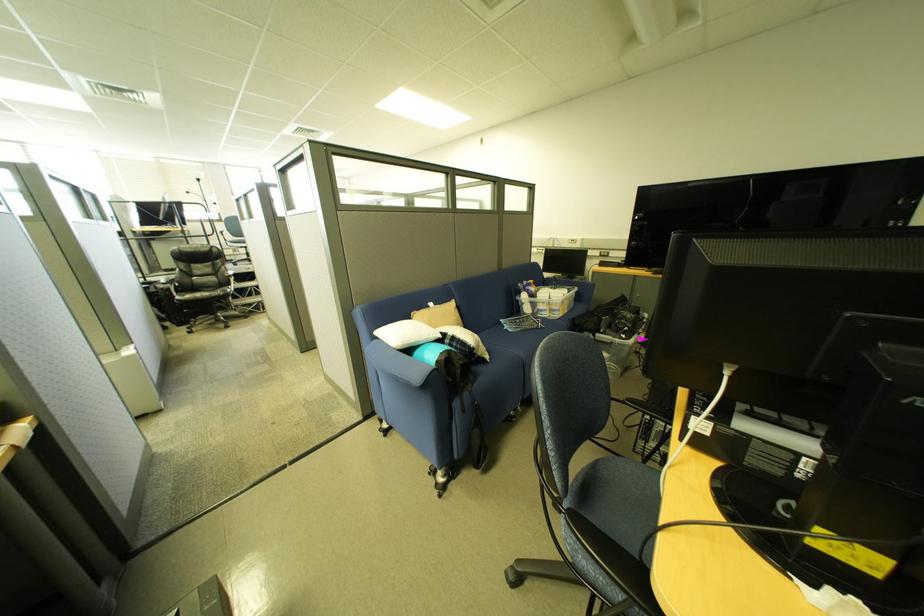
This screenshot has width=924, height=616. What do you see at coordinates (511, 339) in the screenshot?
I see `the blue sofa sitting surface` at bounding box center [511, 339].